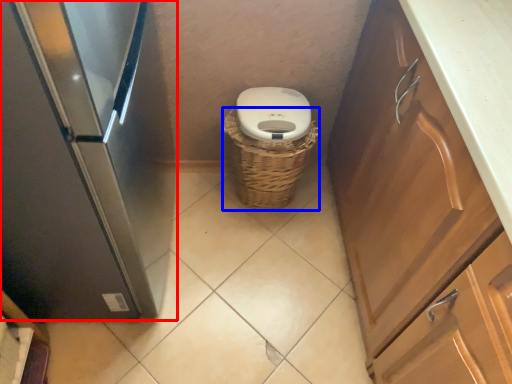
Question: Which object is closer to the camera taking this photo, home appliance (highlighted by a red box) or basket (highlighted by a blue box)?

Choices:
 (A) home appliance
 (B) basket

Answer: (A)